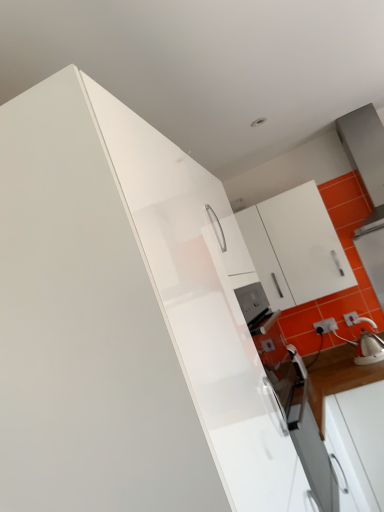
Question: Is white plastic electric outlet at lower right turned away from white glossy cabinet at upper right, marked as the first cabinetry in a right-to-left arrangement?

Choices:
 (A) yes
 (B) no

Answer: (B)

Question: From a real-world perspective, is white plastic electric outlet at lower right on white glossy cabinet at upper right, marked as the first cabinetry in a right-to-left arrangement?

Choices:
 (A) yes
 (B) no

Answer: (B)

Question: Is white plastic electric outlet at lower right not near white glossy cabinet at upper right, the second cabinetry positioned from the left?

Choices:
 (A) no
 (B) yes

Answer: (A)

Question: From a real-world perspective, is white plastic electric outlet at lower right beneath white glossy cabinet at upper right, arranged as the second cabinetry when viewed from the front?

Choices:
 (A) no
 (B) yes

Answer: (B)

Question: Does white plastic electric outlet at lower right come in front of white glossy cabinet at upper right, the 1th cabinetry positioned from the back?

Choices:
 (A) no
 (B) yes

Answer: (A)

Question: Is white plastic electric outlet at lower right at the left side of white glossy cabinet at upper right, arranged as the second cabinetry when viewed from the front?

Choices:
 (A) yes
 (B) no

Answer: (B)

Question: Can you confirm if white plastic electric outlet at lower right is thinner than white glossy cabinet at upper left, which is the second cabinetry in back-to-front order?

Choices:
 (A) yes
 (B) no

Answer: (A)

Question: Does white plastic electric outlet at lower right lie behind white glossy cabinet at upper left, marked as the first cabinetry in a left-to-right arrangement?

Choices:
 (A) yes
 (B) no

Answer: (A)

Question: Would you say white glossy cabinet at upper left, acting as the 1th cabinetry starting from the front, is part of white plastic electric outlet at lower right's contents?

Choices:
 (A) no
 (B) yes

Answer: (A)

Question: Does white plastic electric outlet at lower right lie in front of white glossy cabinet at upper left, marked as the first cabinetry in a left-to-right arrangement?

Choices:
 (A) yes
 (B) no

Answer: (B)

Question: From the image's perspective, is white plastic electric outlet at lower right located above white glossy cabinet at upper left, the 2th cabinetry positioned from the right?

Choices:
 (A) no
 (B) yes

Answer: (A)

Question: Is white plastic electric outlet at lower right not close to white glossy cabinet at upper left, which is the second cabinetry in back-to-front order?

Choices:
 (A) yes
 (B) no

Answer: (A)

Question: From the image's perspective, is white glossy kettle at right on top of white plastic electric outlet at lower right?

Choices:
 (A) yes
 (B) no

Answer: (A)